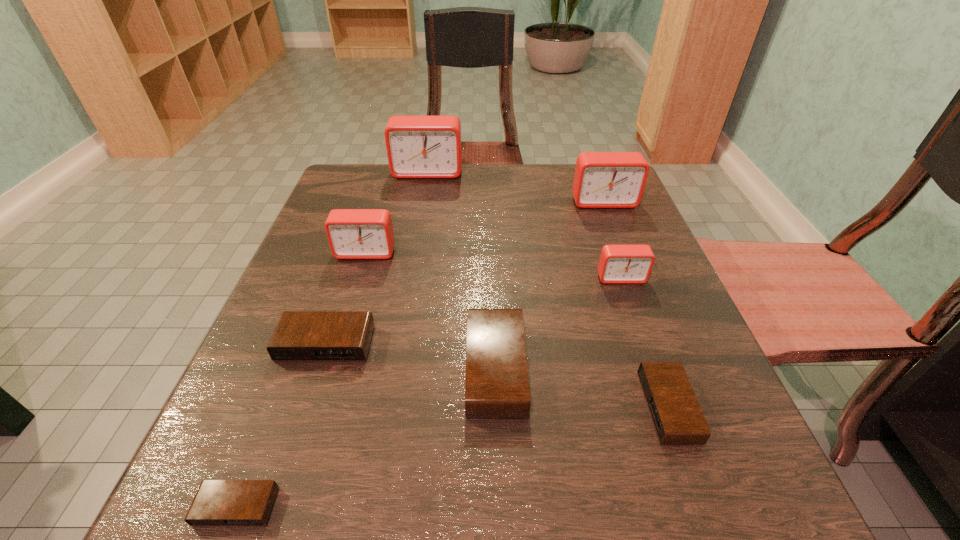
Locate an element on the screen. This screenshot has width=960, height=540. object at the far right corner is located at coordinates pos(602,179).

Where is `vacant space at the far edge of the desktop`? vacant space at the far edge of the desktop is located at coordinates (537, 194).

You are a GUI agent. You are given a task and a screenshot of the screen. Output one action in this format:
    pyautogui.click(x=<x>, y=<y>)
    Task: Click on the vacant space at the near edge of the desktop
    The height and width of the screenshot is (540, 960).
    Given the screenshot: What is the action you would take?
    pyautogui.click(x=612, y=469)

The image size is (960, 540). What are the coordinates of `free space at the left edge of the desktop` in the screenshot? It's located at (261, 355).

Locate an element on the screen. vacant space at the right edge is located at coordinates (621, 357).

Where is `vacant space at the near right corner`? vacant space at the near right corner is located at coordinates (660, 506).

You are a GUI agent. You are given a task and a screenshot of the screen. Output one action in this format:
    pyautogui.click(x=<x>, y=<y>)
    Task: Click on the free area in between the sixth tallest object and the third black alarm clock from left to right
    This screenshot has width=960, height=540.
    Given the screenshot: What is the action you would take?
    pyautogui.click(x=411, y=356)

The image size is (960, 540). In order to click on free space that is in between the fourth farthest alarm clock and the seventh shortest object in this screenshot , I will do `click(612, 240)`.

Identify the location of vacant area that lies between the seventh nearest alarm clock and the nearest red alarm clock. (612, 240).

Identify the location of empty location between the third farthest alarm clock and the fourth shortest alarm clock. (431, 310).